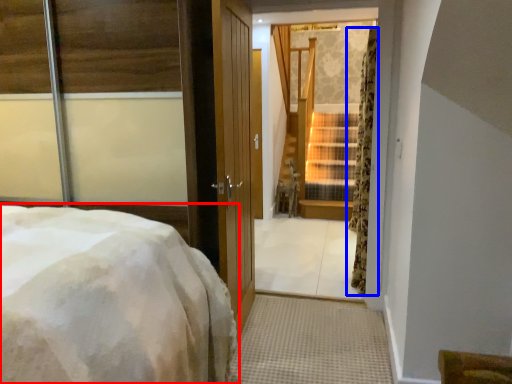
Question: Which object appears closest to the camera in this image, bed (highlighted by a red box) or curtain (highlighted by a blue box)?

Choices:
 (A) bed
 (B) curtain

Answer: (A)